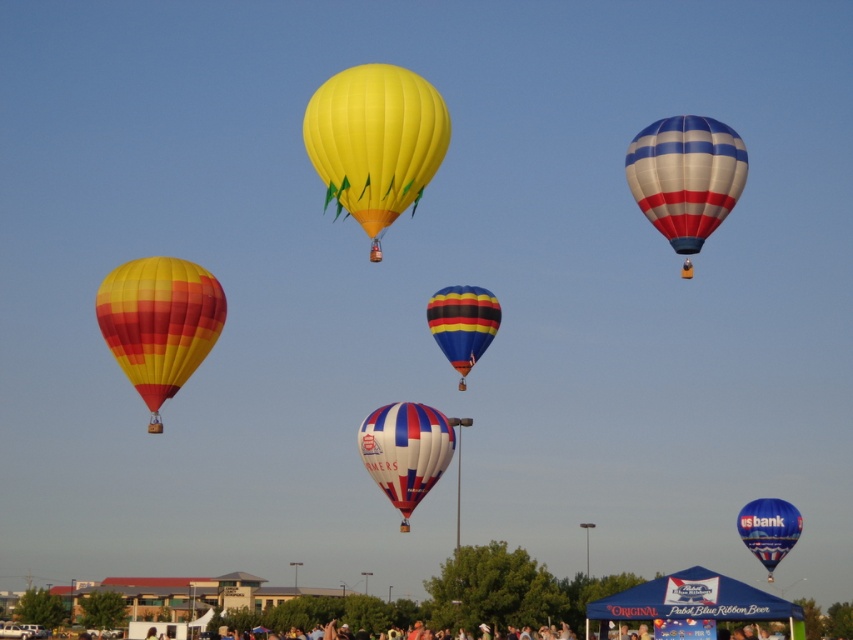
You are a photographer trying to capture both the white and blue striped hot air balloon at upper right and the white and blue striped balloon at center in a single shot. Which balloon will appear taller in your photo?

The white and blue striped hot air balloon at upper right will appear taller in the photo because it has a greater height compared to the white and blue striped balloon at center.